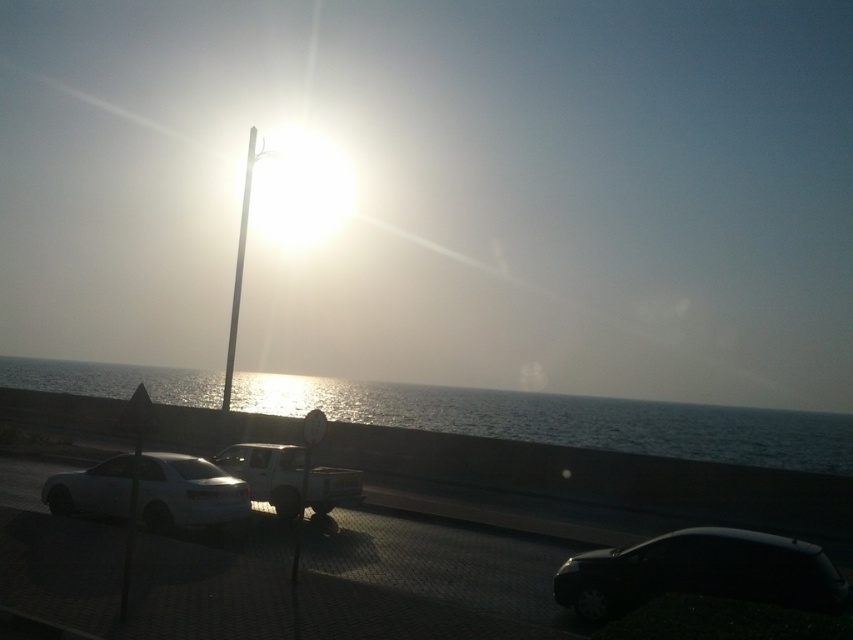
You are a delivery drone operator. Your drone has a maximum flight range of 100 meters. You need to deliver a package from the glistening water at center to the black glossy car at lower right. Based on the scene, can your drone complete this delivery without needing a recharge?

The distance between glistening water at center and black glossy car at lower right is 104.87 meters. Since the drone can only fly 100 meters before needing a recharge, it cannot complete the delivery without recharging.

You are a photographer planning to capture the coastal scene. You want to ensure that the glistening water at center and the white glossy pole at center are both in frame. Which object should you adjust your camera angle to prioritize if you need to focus on the wider one?

The glistening water at center is wider than the white glossy pole at center, so you should prioritize focusing on the glistening water at center to ensure it fits properly in the frame.

You are a photographer planning to take a sunset photo. You want to ensure that the glistening water at center and the white glossy pole at center are both visible in the frame. Which object should you adjust your camera angle to prioritize capturing first?

The glistening water at center is taller than the white glossy pole at center, so you should prioritize capturing the glistening water at center first as it occupies more vertical space in the frame.